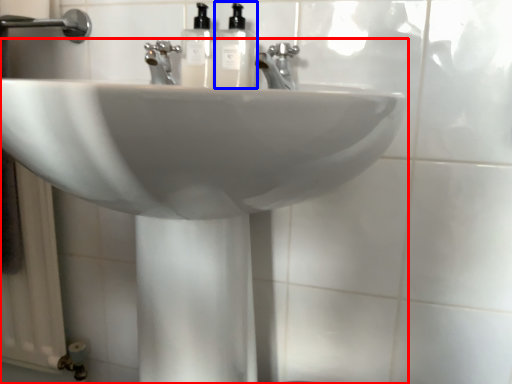
Question: Which of the following is the farthest to the observer, sink (highlighted by a red box) or soap dispenser (highlighted by a blue box)?

Choices:
 (A) sink
 (B) soap dispenser

Answer: (B)